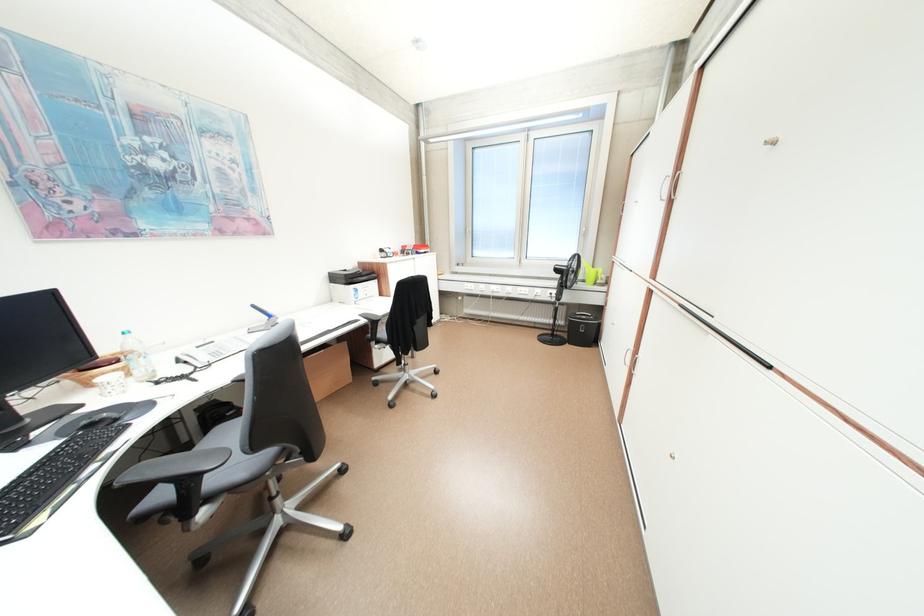
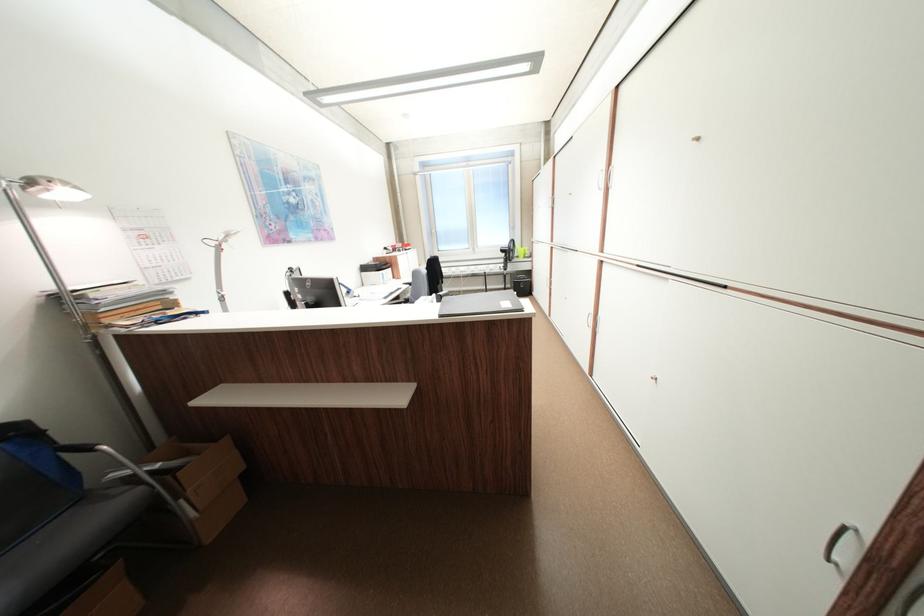
In a continuous first-person perspective shot, in which direction is the camera moving?

The cameraman walked toward left, backward.